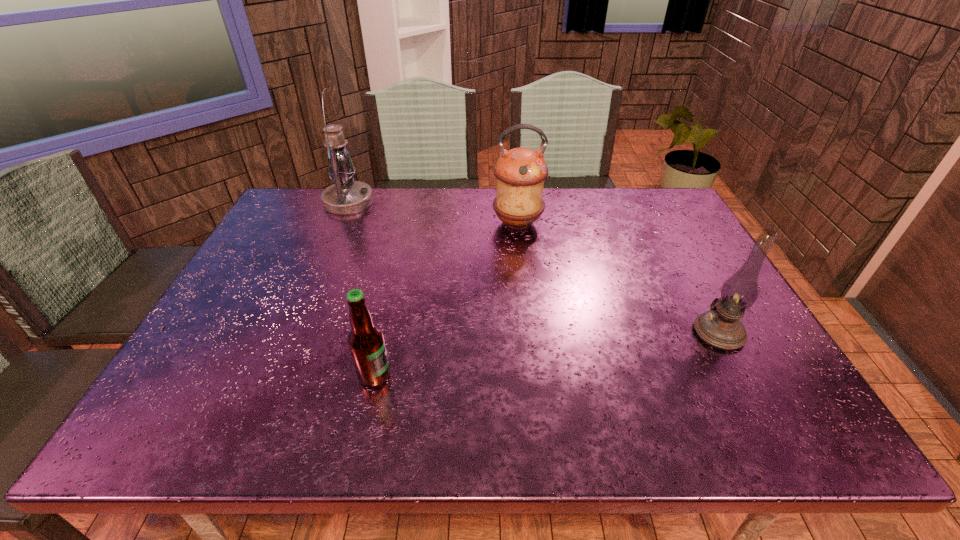
At what (x,y) coordinates should I click in order to perform the action: click on the leftmost object. Please return your answer as a coordinate pair (x, y). The image size is (960, 540). Looking at the image, I should click on (346, 196).

The image size is (960, 540). I want to click on the third object from left to right, so click(520, 172).

At what (x,y) coordinates should I click in order to perform the action: click on the nearest oil lamp. Please return your answer as a coordinate pair (x, y). This screenshot has width=960, height=540. Looking at the image, I should click on (720, 327).

This screenshot has width=960, height=540. I want to click on the rightmost oil lamp, so click(x=720, y=327).

This screenshot has height=540, width=960. Find the location of `the shortest object`. the shortest object is located at coordinates (366, 343).

I want to click on the nearest object, so click(366, 343).

Identify the location of free point located 0.370m on the front of the leftmost object. The height and width of the screenshot is (540, 960). (309, 292).

The image size is (960, 540). What are the coordinates of `vacant space located on the front of the third object from left to right` in the screenshot? It's located at (529, 320).

I want to click on free space located on the left of the rightmost oil lamp, so pyautogui.click(x=660, y=332).

Locate an element on the screen. This screenshot has height=540, width=960. vacant region located 0.150m on the label of the beer bottle is located at coordinates (460, 375).